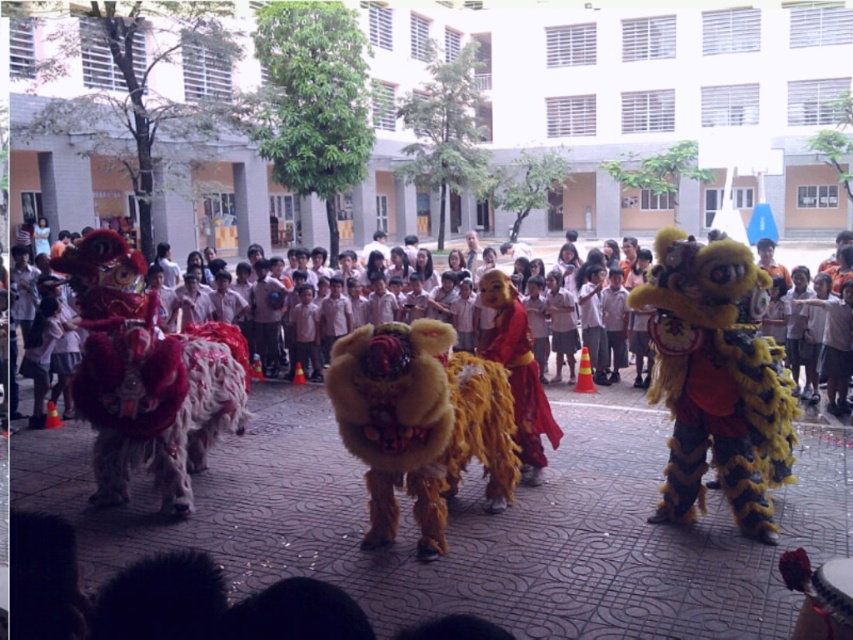
Question: Which of these objects is positioned closest to the shiny red lion at left?

Choices:
 (A) fuzzy yellow lion at center
 (B) shiny red fabric lion at center

Answer: (A)

Question: Estimate the real-world distances between objects in this image. Which object is farther from the shiny red lion at left?

Choices:
 (A) yellow furry lion at right
 (B) shiny red fabric lion at center

Answer: (A)

Question: Does fuzzy yellow lion at center appear on the left side of shiny red fabric lion at center?

Choices:
 (A) no
 (B) yes

Answer: (B)

Question: Among these points, which one is farthest from the camera?

Choices:
 (A) (393, 422)
 (B) (764, 387)

Answer: (B)

Question: Does yellow furry lion at right have a greater width compared to shiny red fabric lion at center?

Choices:
 (A) yes
 (B) no

Answer: (A)

Question: Does yellow furry lion at right lie behind shiny red fabric lion at center?

Choices:
 (A) yes
 (B) no

Answer: (B)